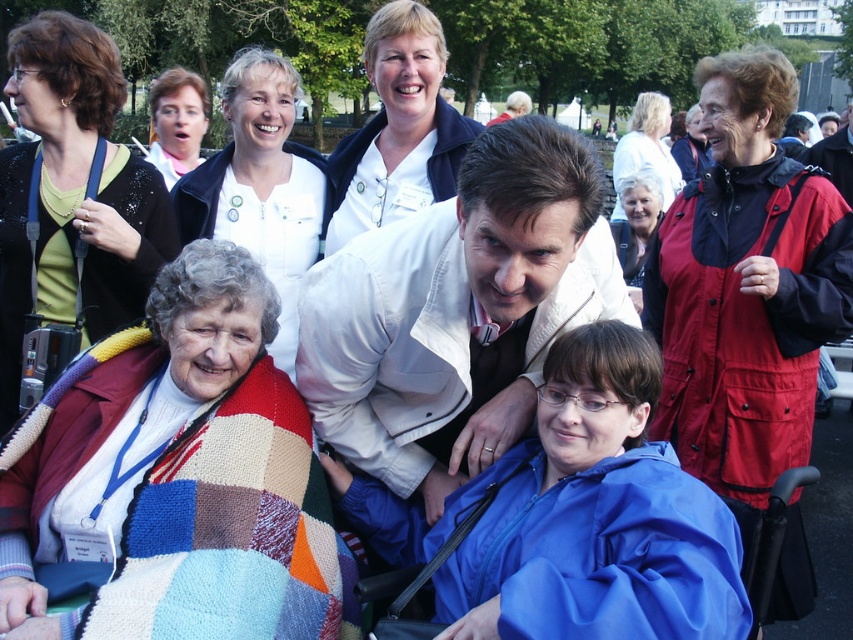
Is point (132, 413) less distant than point (202, 83)?

Yes, point (132, 413) is in front of point (202, 83).

Who is positioned more to the left, knitted blanket at lower left or matte white blouse at upper left?

matte white blouse at upper left is more to the left.

Does point (132, 470) come in front of point (164, 145)?

Yes.

This screenshot has height=640, width=853. I want to click on knitted blanket at lower left, so click(177, 477).

Is white matte jacket at center shorter than red nylon jacket at upper right?

Indeed, white matte jacket at center has a lesser height compared to red nylon jacket at upper right.

Is white matte jacket at center wider than red nylon jacket at upper right?

Yes.

The width and height of the screenshot is (853, 640). I want to click on white matte jacket at center, so click(x=457, y=310).

Is knitted blanket at lower left above white smooth shirt at upper center?

No, knitted blanket at lower left is not above white smooth shirt at upper center.

Is knitted blanket at lower left to the left of white smooth shirt at upper center from the viewer's perspective?

No, knitted blanket at lower left is not to the left of white smooth shirt at upper center.

Between point (212, 248) and point (258, 198), which one is positioned behind?

The point (258, 198) is behind.

The width and height of the screenshot is (853, 640). Find the location of `knitted blanket at lower left`. knitted blanket at lower left is located at coordinates (x=177, y=477).